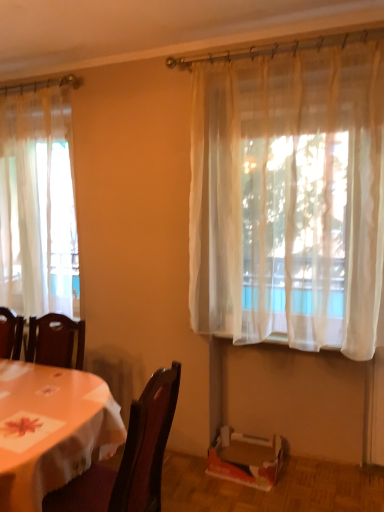
The height and width of the screenshot is (512, 384). I want to click on free space above wooden table at lower left (from a real-world perspective), so click(x=37, y=389).